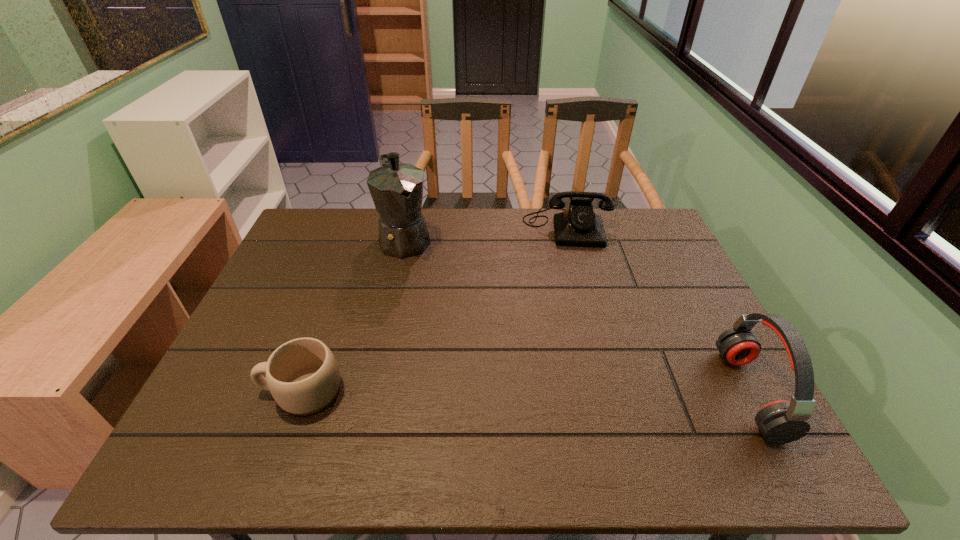
Where is `mug`? This screenshot has height=540, width=960. mug is located at coordinates (302, 375).

Find the location of a particular element. This screenshot has width=960, height=540. earphone is located at coordinates (782, 421).

You are a GUI agent. You are given a task and a screenshot of the screen. Output one action in this format:
    pyautogui.click(x=<x>, y=<y>)
    Task: Click on the rightmost object
    The height and width of the screenshot is (540, 960).
    Given the screenshot: What is the action you would take?
    pyautogui.click(x=782, y=421)

Locate an element on the screen. This screenshot has height=540, width=960. the third object from left to right is located at coordinates (578, 225).

You are a GUI agent. You are given a task and a screenshot of the screen. Output one action in this format:
    pyautogui.click(x=<x>, y=<y>)
    Task: Click on the coffeepot
    
    Given the screenshot: What is the action you would take?
    pyautogui.click(x=397, y=189)

The height and width of the screenshot is (540, 960). I want to click on blank space located 0.280m on the front face of the third object from left to right, so click(x=578, y=312).

The width and height of the screenshot is (960, 540). In order to click on vacant space situated on the front face of the third object from left to right in this screenshot , I will do `click(573, 278)`.

Where is `free location located 0.100m on the front face of the third object from left to right`? free location located 0.100m on the front face of the third object from left to right is located at coordinates (572, 268).

Locate an element on the screen. free region located 0.370m on the pouring side of the coffeepot is located at coordinates (458, 350).

Find the location of a particular element. This screenshot has width=960, height=540. vacant space located 0.160m on the pouring side of the coffeepot is located at coordinates (429, 296).